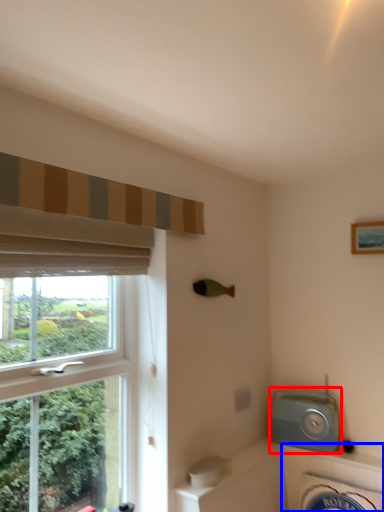
Question: Which object is further to the camera taking this photo, appliance (highlighted by a red box) or bath (highlighted by a blue box)?

Choices:
 (A) appliance
 (B) bath

Answer: (A)